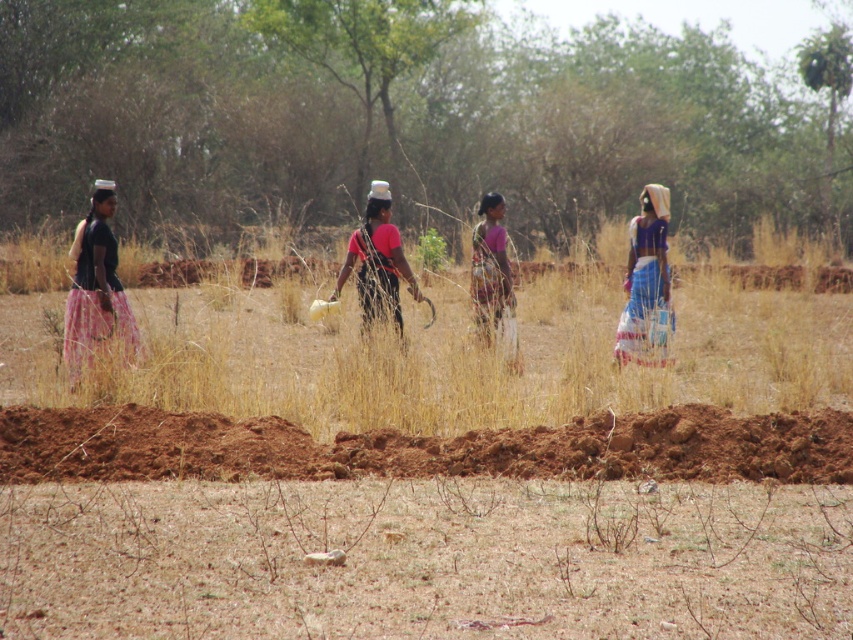
You are a traveler walking along the dry field and see two points marked in the scene. Which point is closer to you, the point at coordinate [148,458] or the point at coordinate [654,211]?

The point at coordinate [148,458] is closer to you because it is in front of the point at coordinate [654,211].

You are standing at the point marked by the coordinates (422, 445) in the image. Looking around, you see a dry grassy field with four women carrying water containers on their heads. What is the elevation of the ground at your current position compared to the surrounding area?

The elevation at point (422, 445) is higher than the surrounding area because it is a brown earth mound.